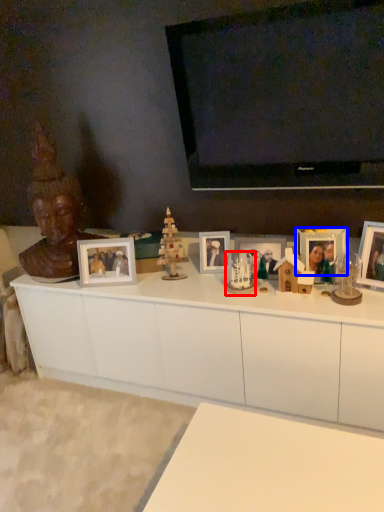
Question: Among these objects, which one is farthest to the camera, toy (highlighted by a red box) or picture frame (highlighted by a blue box)?

Choices:
 (A) toy
 (B) picture frame

Answer: (B)